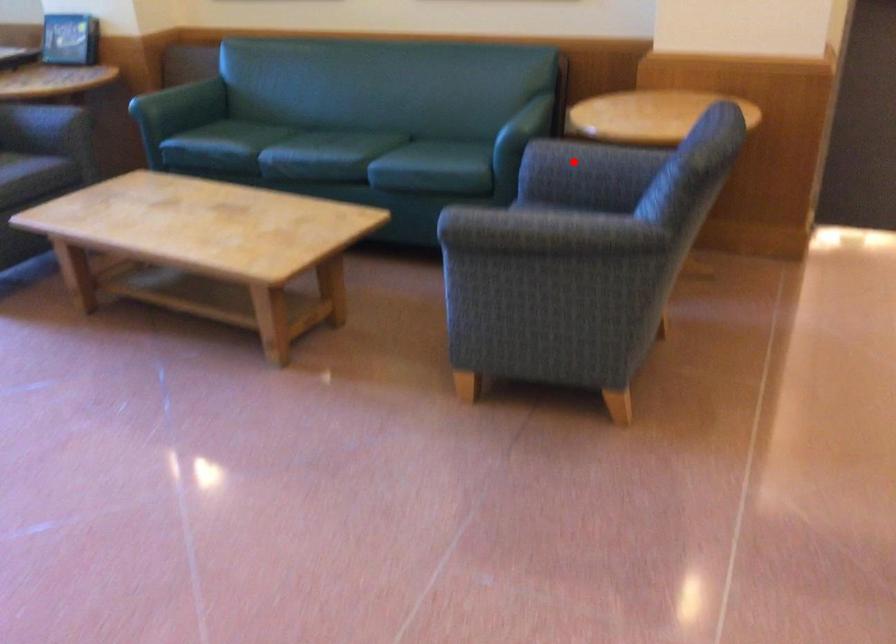
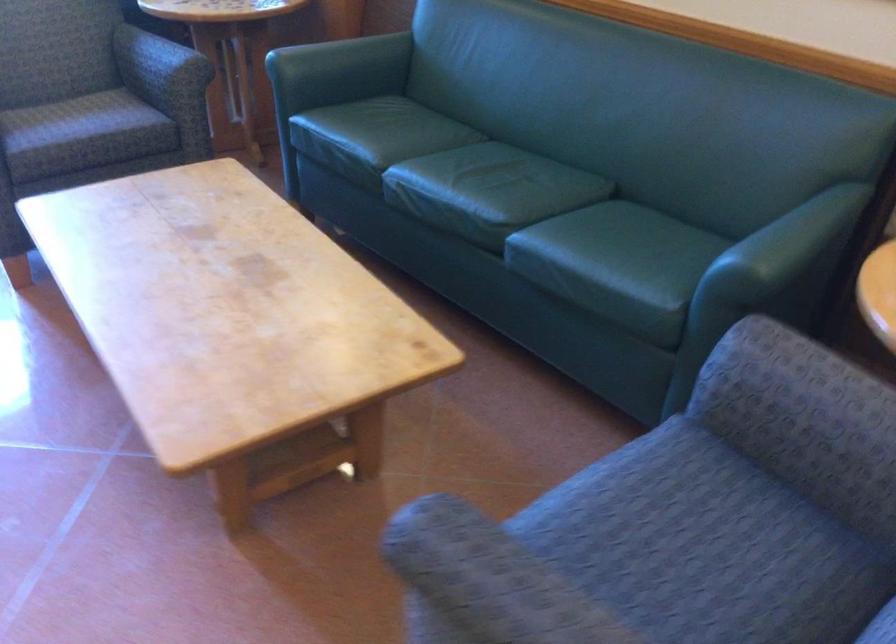
Question: I am providing you with two images of the same scene from different viewpoints. In image1, a red point is highlighted. Considering the same 3D point in image2, which of the following is correct?

Choices:
 (A) It is closer
 (B) It is farther

Answer: (A)